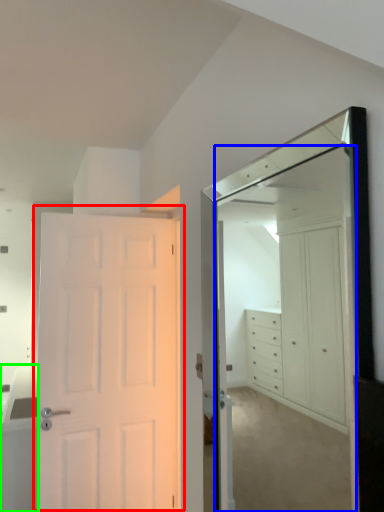
Question: Which object is positioned closest to door (highlighted by a red box)? Select from mirror (highlighted by a blue box) and cabinetry (highlighted by a green box).

Choices:
 (A) mirror
 (B) cabinetry

Answer: (B)